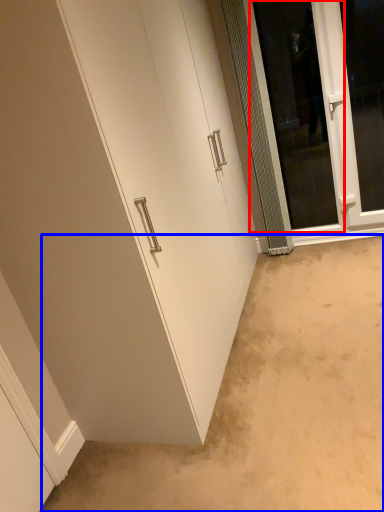
Question: Which point is further to the camera, screen door (highlighted by a red box) or plain (highlighted by a blue box)?

Choices:
 (A) screen door
 (B) plain

Answer: (A)